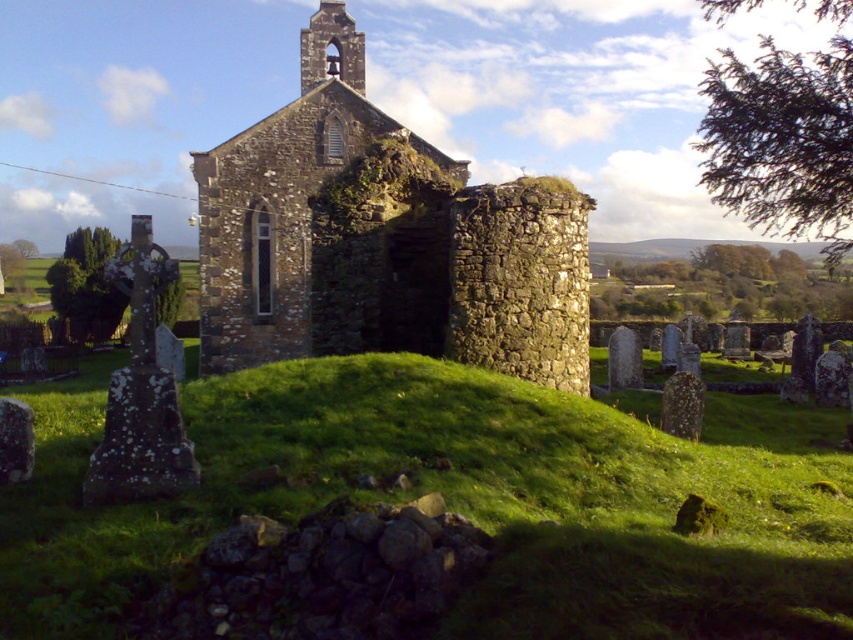
Question: Among these objects, which one is nearest to the camera?

Choices:
 (A) green grassy mound at center
 (B) rustic stone church at center

Answer: (A)

Question: Can you confirm if green grassy mound at center is thinner than rustic stone church at center?

Choices:
 (A) yes
 (B) no

Answer: (B)

Question: Which object appears farthest from the camera in this image?

Choices:
 (A) rustic stone church at center
 (B) green grassy mound at center

Answer: (A)

Question: In this image, where is green grassy mound at center located relative to rustic stone church at center?

Choices:
 (A) left
 (B) right

Answer: (B)

Question: Is green grassy mound at center smaller than rustic stone church at center?

Choices:
 (A) no
 (B) yes

Answer: (B)